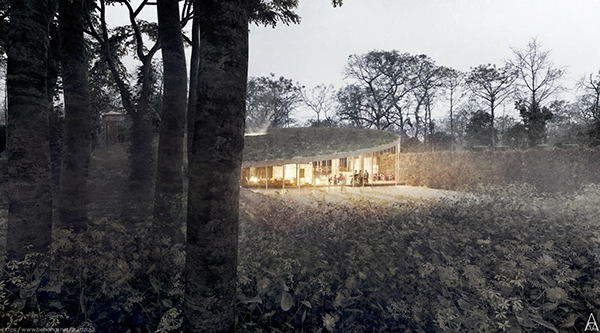
Locate an element on the screen. This screenshot has height=333, width=600. lamps is located at coordinates (253, 182).